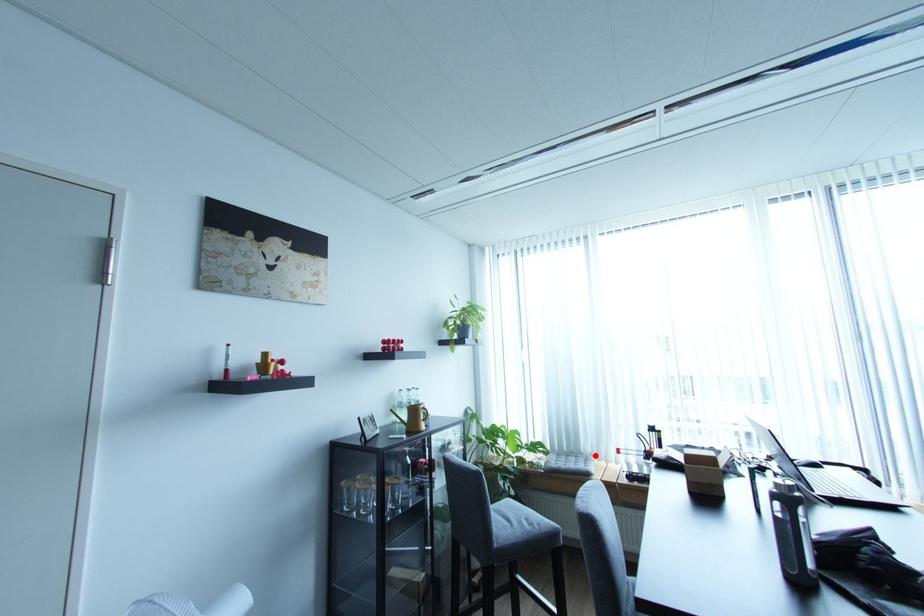
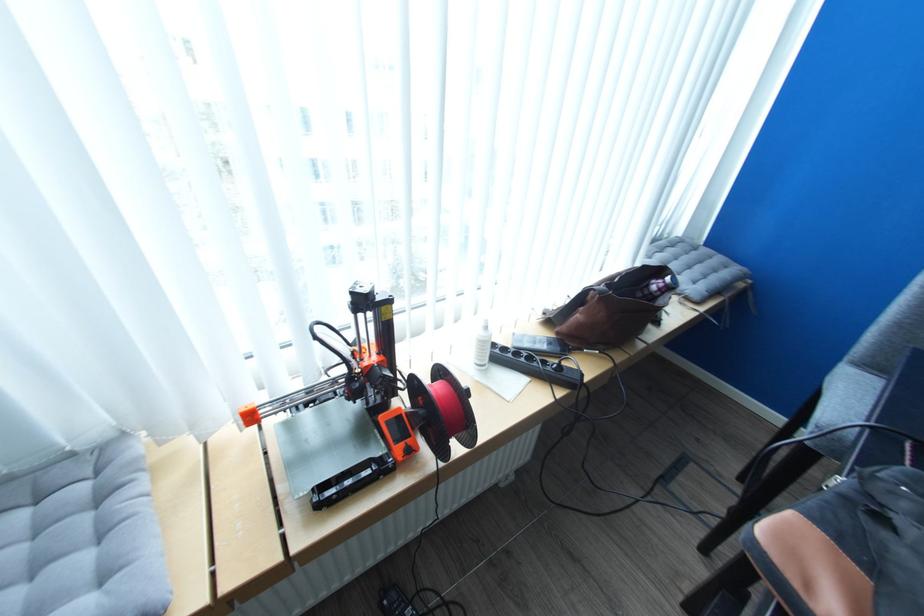
The point at the highlighted location is marked in the first image. Where is the corresponding point in the second image?

(124, 436)